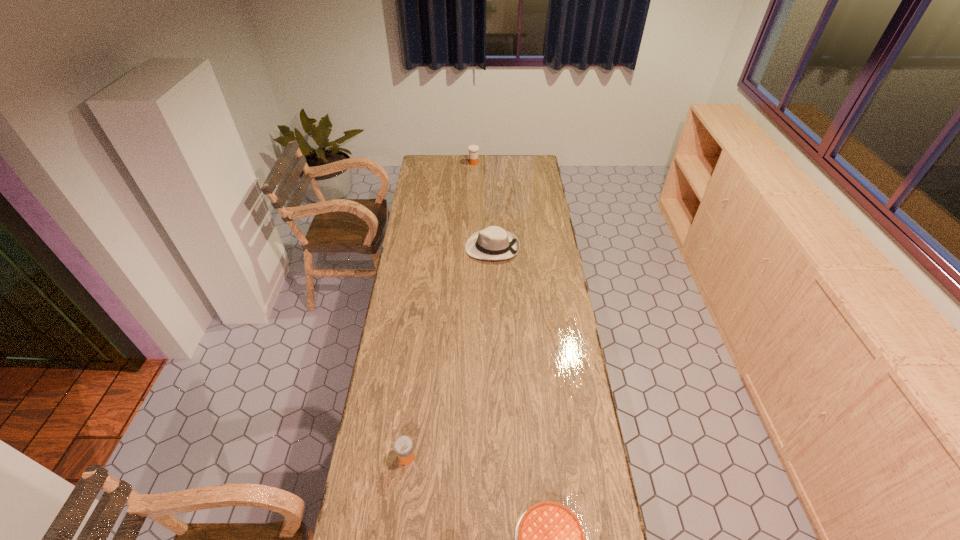
Where is `the farthest object`? The image size is (960, 540). the farthest object is located at coordinates (473, 149).

Where is `the right medicine`? the right medicine is located at coordinates (473, 149).

You are a GUI agent. You are given a task and a screenshot of the screen. Output one action in this format:
    pyautogui.click(x=<x>, y=<y>)
    Task: Click on the fedora
    The width and height of the screenshot is (960, 540).
    Given the screenshot: What is the action you would take?
    pyautogui.click(x=494, y=243)

At what (x,y) coordinates should I click in order to perform the action: click on the leftmost object. Please return your answer as a coordinate pair (x, y). The image size is (960, 540). Looking at the image, I should click on (403, 445).

This screenshot has width=960, height=540. I want to click on the third farthest object, so click(403, 445).

What are the coordinates of `free space located on the label of the farther medicine` in the screenshot? It's located at (522, 163).

Identify the location of blank space located on the front-facing side of the third nearest object. (441, 247).

Locate an element on the screen. vacant space situated 0.070m on the front-facing side of the third nearest object is located at coordinates (451, 247).

Find the location of `blank space located 0.100m on the front-facing side of the third nearest object`. blank space located 0.100m on the front-facing side of the third nearest object is located at coordinates (444, 247).

I want to click on vacant space located on the label side of the left medicine, so click(x=516, y=457).